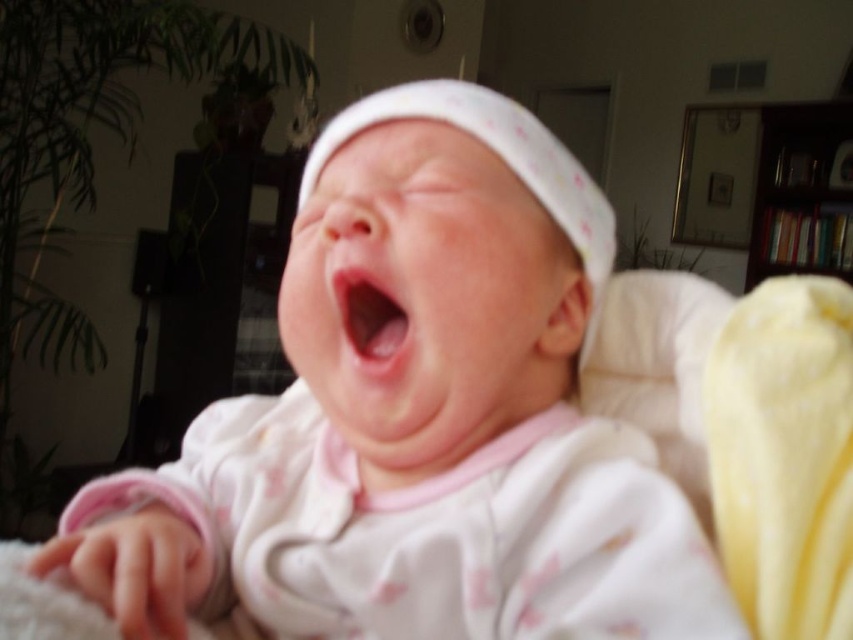
Question: Among these points, which one is farthest from the camera?

Choices:
 (A) pyautogui.click(x=503, y=401)
 (B) pyautogui.click(x=352, y=358)

Answer: (A)

Question: Which of the following is the closest to the observer?

Choices:
 (A) (341, 310)
 (B) (334, 570)

Answer: (B)

Question: Observing the image, what is the correct spatial positioning of white soft baby at center in reference to pink matte/skinny object at center?

Choices:
 (A) below
 (B) above

Answer: (A)

Question: Which point appears closest to the camera in this image?

Choices:
 (A) (384, 298)
 (B) (426, 301)

Answer: (B)

Question: Observing the image, what is the correct spatial positioning of white soft baby at center in reference to pink matte/skinny object at center?

Choices:
 (A) left
 (B) right

Answer: (A)

Question: Does white soft baby at center appear under pink matte/skinny object at center?

Choices:
 (A) yes
 (B) no

Answer: (A)